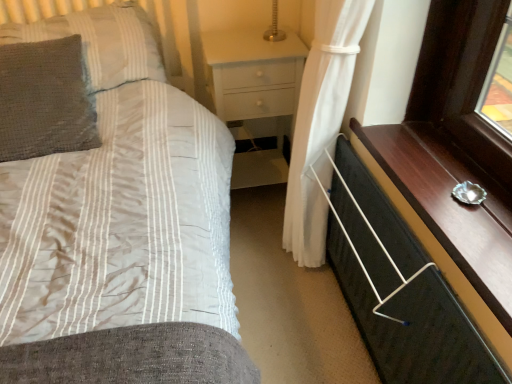
Identify the location of free area in between white glossy nightstand at center and white fabric curtain at lower right. The width and height of the screenshot is (512, 384). (264, 252).